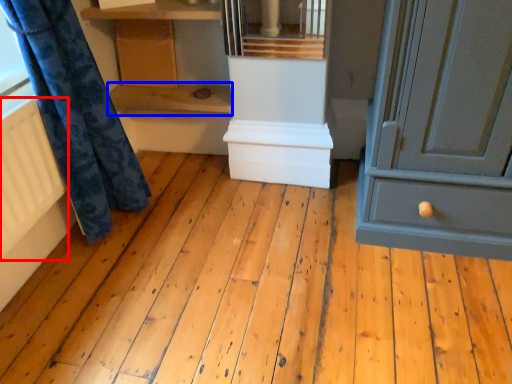
Question: Which point is closer to the camera, radiator (highlighted by a red box) or shelf (highlighted by a blue box)?

Choices:
 (A) radiator
 (B) shelf

Answer: (A)